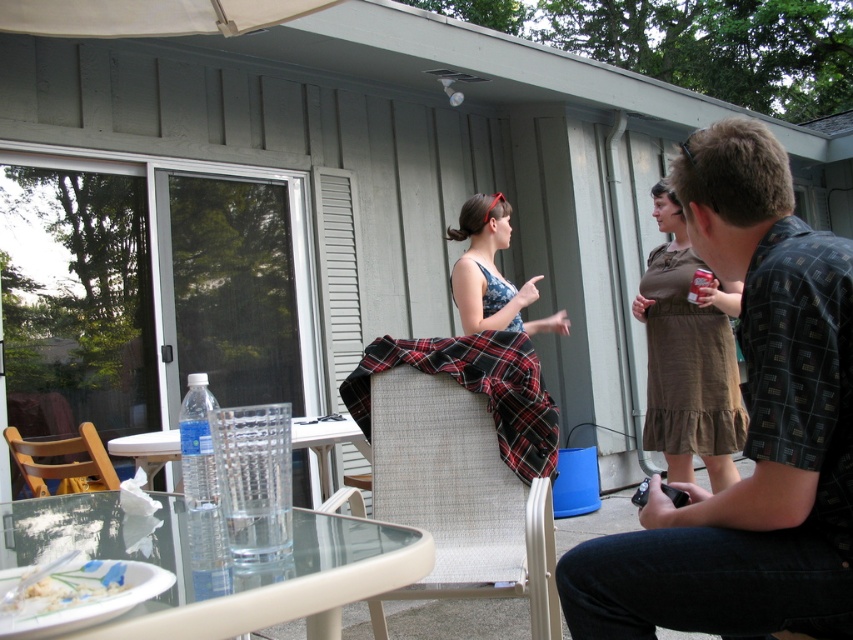
You are organizing a small outdoor gathering and need to place a matte floral dress at center on the table. However, there is already a plaid fabric chair at center in the way. Which object should you move to make space?

You should move the plaid fabric chair at center because it is positioned on the left side of the matte floral dress at center, meaning it is blocking the area where the dress needs to be placed.

You are standing on the patio and want to pick up an item from the table. The items are located at two specific points on the table. Which point, point (38, 529) or point (498, 573), is closer to you when you are facing the table?

Point (38, 529) is closer to the viewer than point (498, 573).